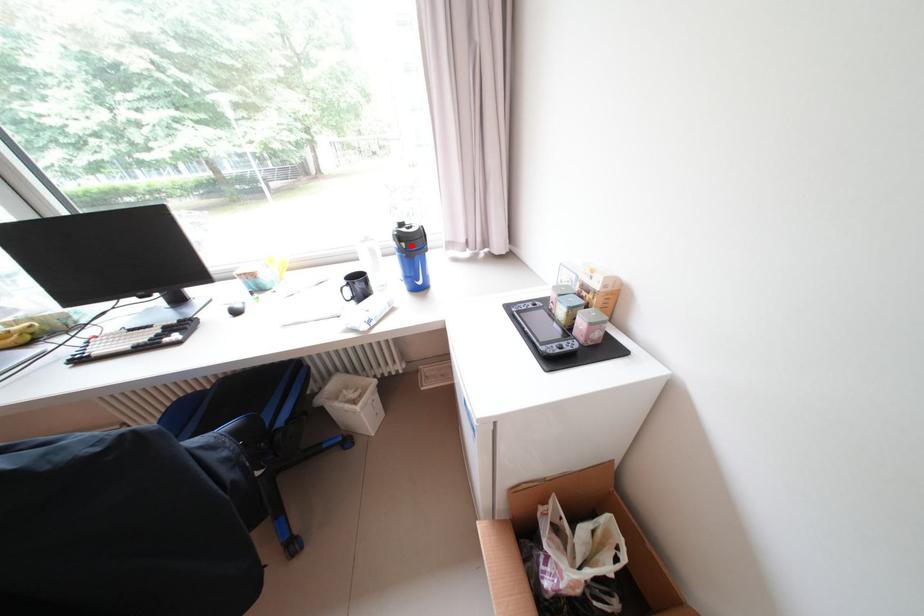
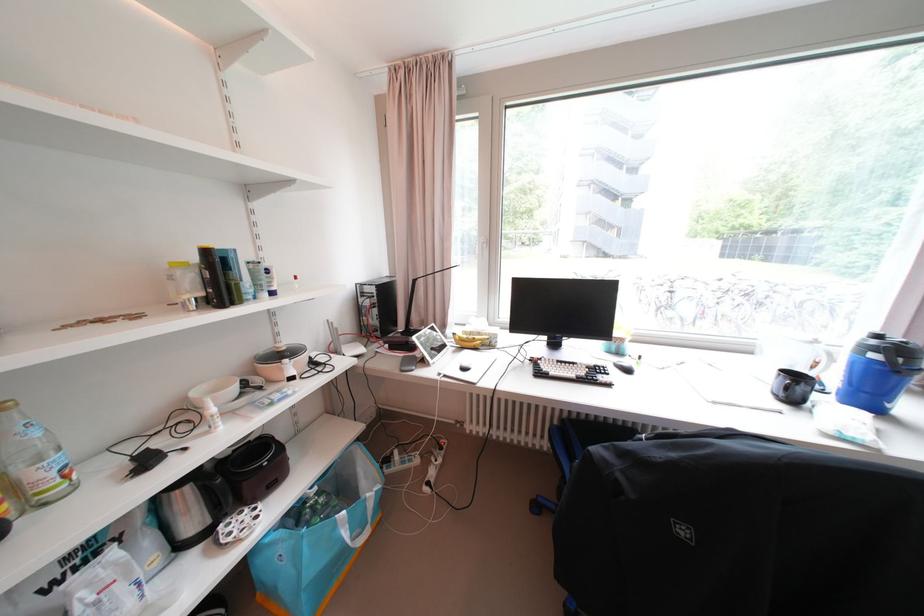
The point at the highlighted location is marked in the first image. Where is the corresponding point in the second image?

(909, 361)